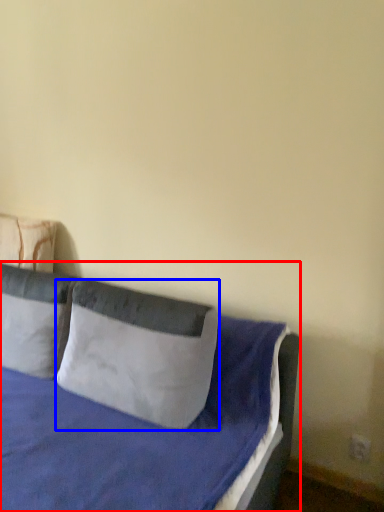
Question: Which object appears closest to the camera in this image, bed (highlighted by a red box) or pillow (highlighted by a blue box)?

Choices:
 (A) bed
 (B) pillow

Answer: (A)